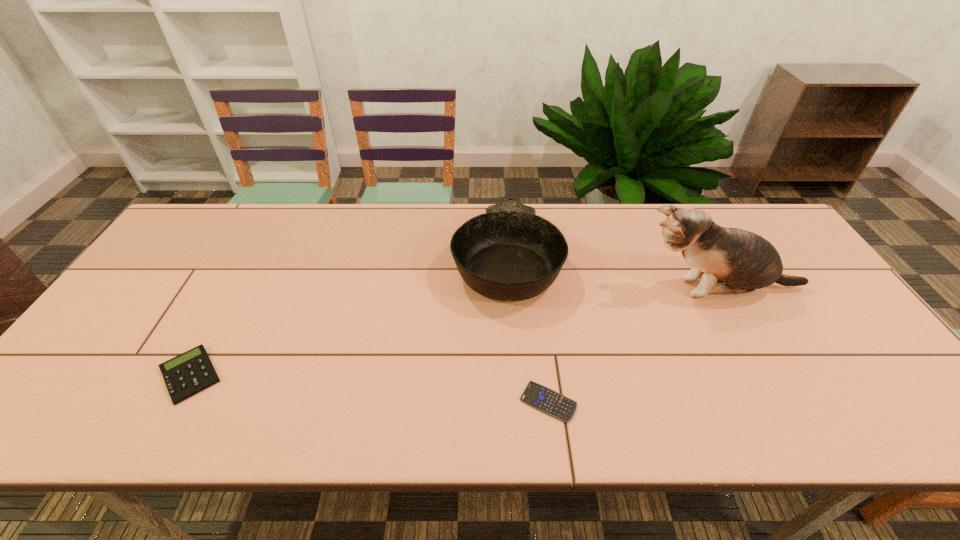
You are a GUI agent. You are given a task and a screenshot of the screen. Output one action in this format:
    pyautogui.click(x=<x>, y=<y>)
    Task: Click on the rightmost object
    
    Given the screenshot: What is the action you would take?
    pyautogui.click(x=745, y=261)

Where is `the tallest object`? The image size is (960, 540). the tallest object is located at coordinates (745, 261).

The width and height of the screenshot is (960, 540). Identify the location of frying pan. (508, 253).

Image resolution: width=960 pixels, height=540 pixels. What are the coordinates of `the leftmost object` in the screenshot? It's located at (191, 372).

This screenshot has height=540, width=960. I want to click on the third tallest object, so click(191, 372).

Where is `the right calculator`? Image resolution: width=960 pixels, height=540 pixels. the right calculator is located at coordinates (538, 396).

What are the coordinates of `the shortest object` in the screenshot? It's located at (538, 396).

The image size is (960, 540). Identify the location of free spot located 0.230m at the face of the rightmost object. (549, 288).

Where is `blank area located at the face of the rightmost object`? This screenshot has height=540, width=960. blank area located at the face of the rightmost object is located at coordinates (575, 288).

Find the location of a particular element. The height and width of the screenshot is (540, 960). vacant space located at the face of the rightmost object is located at coordinates (532, 288).